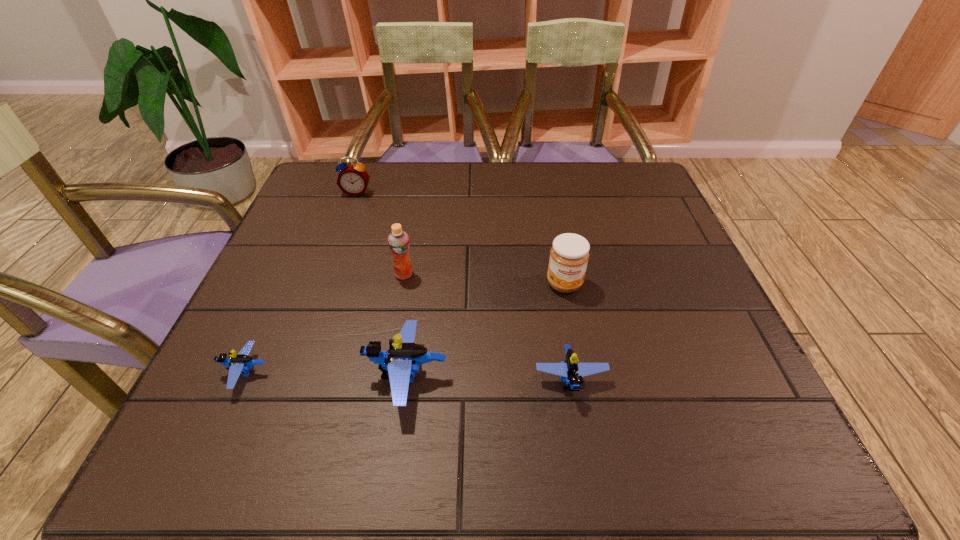
Where is `vacant space situated 0.100m on the front-facing side of the tallest Lego`? This screenshot has width=960, height=540. vacant space situated 0.100m on the front-facing side of the tallest Lego is located at coordinates (311, 376).

Locate an element on the screen. The image size is (960, 540). free space located 0.260m on the front-facing side of the tallest Lego is located at coordinates (222, 376).

Identify the location of vacant space situated 0.280m on the front-facing side of the farthest object. (329, 267).

Locate an element on the screen. The height and width of the screenshot is (540, 960). free space located on the front label of the jam is located at coordinates (580, 364).

Where is `vacant position located 0.160m on the right of the tallest object`? The width and height of the screenshot is (960, 540). vacant position located 0.160m on the right of the tallest object is located at coordinates (486, 274).

The height and width of the screenshot is (540, 960). I want to click on object present at the far edge, so click(353, 179).

Identify the location of Lego that is at the left edge. This screenshot has width=960, height=540. (239, 364).

At what (x,y) coordinates should I click in order to perform the action: click on alarm clock that is at the left edge. Please return your answer as a coordinate pair (x, y). The image size is (960, 540). Looking at the image, I should click on (353, 179).

Find the location of a particular element. Image resolution: width=960 pixels, height=540 pixels. object present at the far left corner is located at coordinates (353, 179).

In order to click on object that is at the near left corner in this screenshot , I will do `click(239, 364)`.